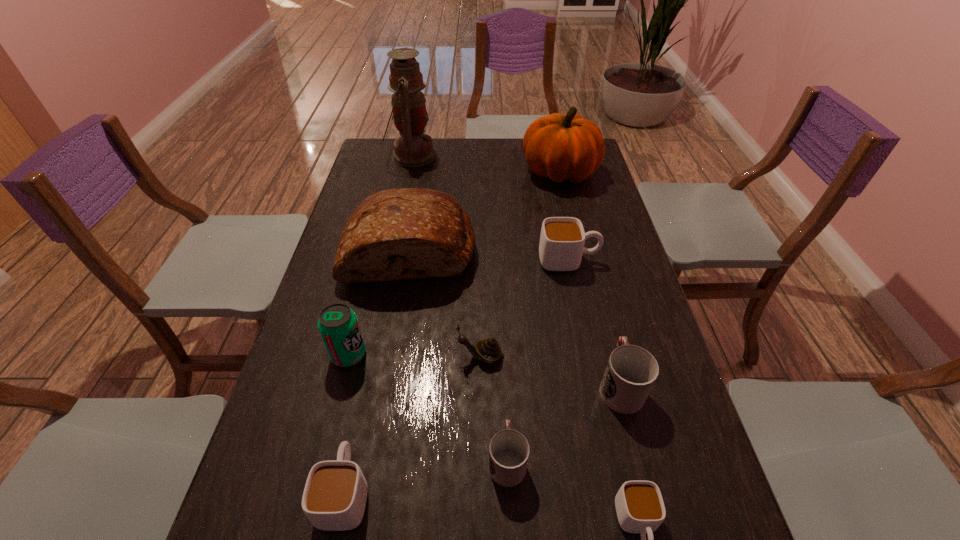
Identify the location of free point that satisfies the following two spatial constraints: 1. on the front-facing side of the seventh shortest object; 2. on the handle side of the farther red cup. (341, 385).

Find the location of a particular element. This screenshot has height=540, width=960. free point that satisfies the following two spatial constraints: 1. at the sliced front of the bread; 2. on the front-facing side of the seventh shortest object is located at coordinates (392, 355).